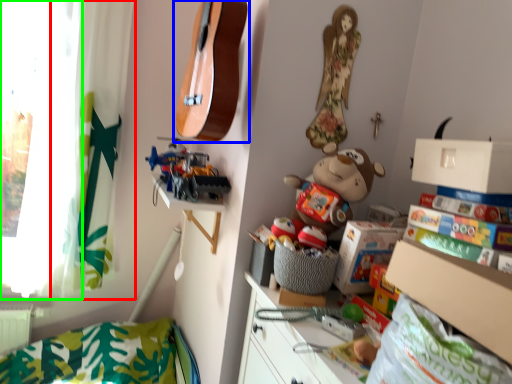
Question: Which is nearer to the curtain (highlighted by a red box)? guitar (highlighted by a blue box) or window screen (highlighted by a green box).

Choices:
 (A) guitar
 (B) window screen

Answer: (B)